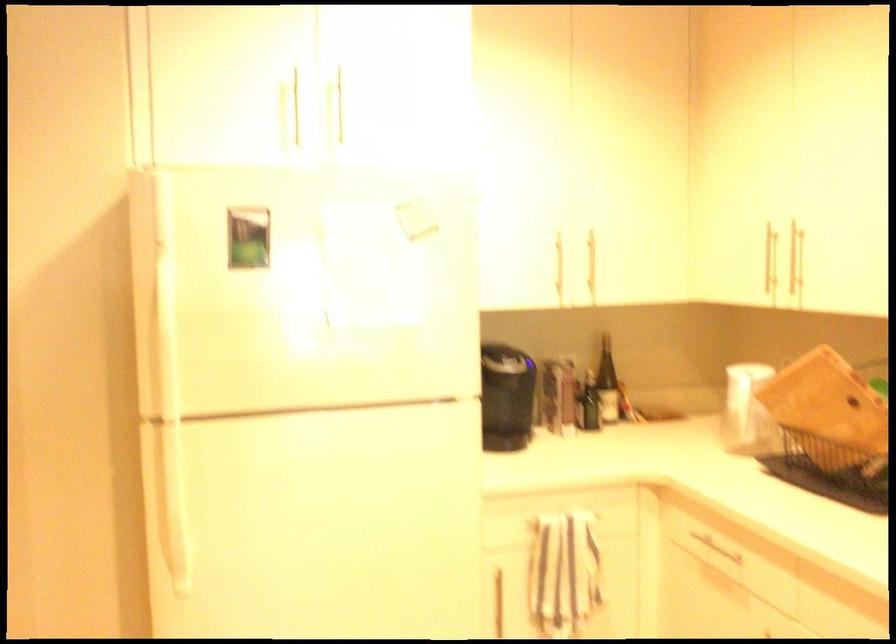
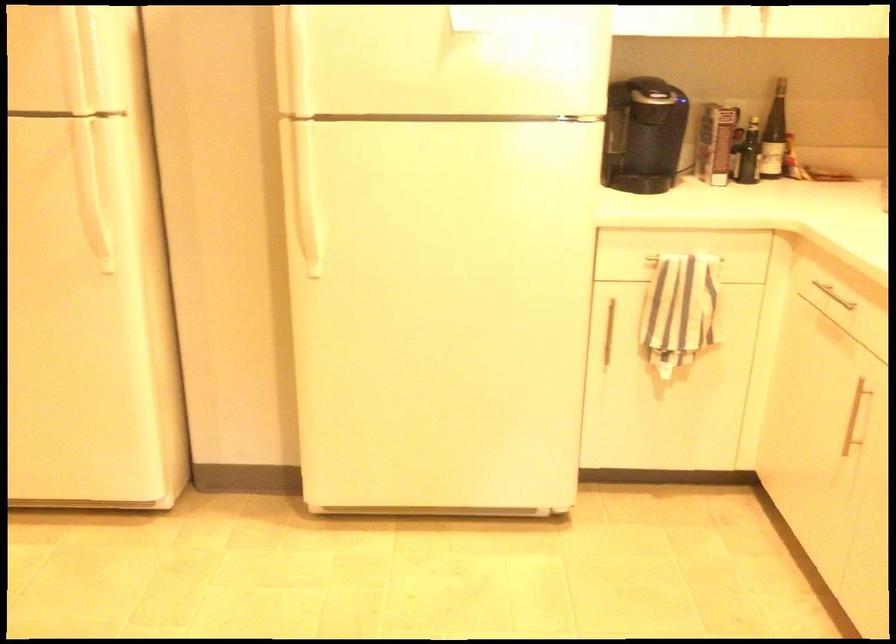
Question: What movement of the cameraman would produce the second image?

Choices:
 (A) Left
 (B) Right
 (C) Forward
 (D) Backward

Answer: (B)